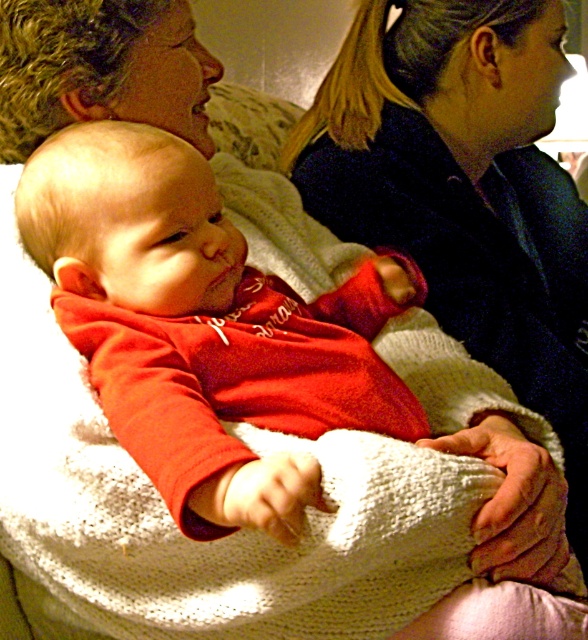
Question: Among these points, which one is farthest from the camera?

Choices:
 (A) (527, 163)
 (B) (380, 321)

Answer: (A)

Question: Does matte red sweater at center have a larger size compared to matte black sweater at upper right?

Choices:
 (A) no
 (B) yes

Answer: (A)

Question: Which point is closer to the camera taking this photo?

Choices:
 (A) (315, 368)
 (B) (449, 324)

Answer: (A)

Question: Can you confirm if matte red sweater at center is positioned below matte black sweater at upper right?

Choices:
 (A) no
 (B) yes

Answer: (B)

Question: Where is matte red sweater at center located in relation to matte black sweater at upper right in the image?

Choices:
 (A) left
 (B) right

Answer: (A)

Question: Which object appears farthest from the camera in this image?

Choices:
 (A) matte black sweater at upper right
 (B) matte red sweater at center

Answer: (A)